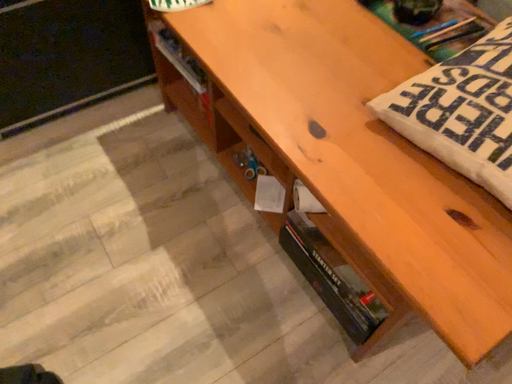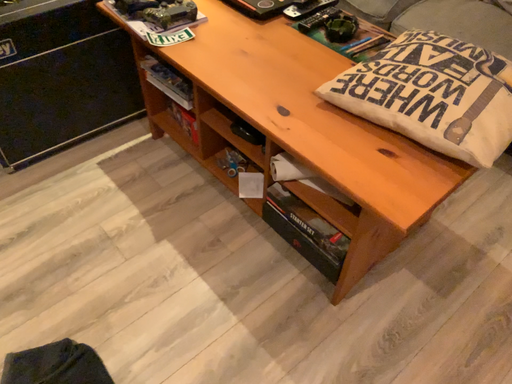
Question: How did the camera likely rotate when shooting the video?

Choices:
 (A) rotated downward
 (B) rotated upward

Answer: (B)